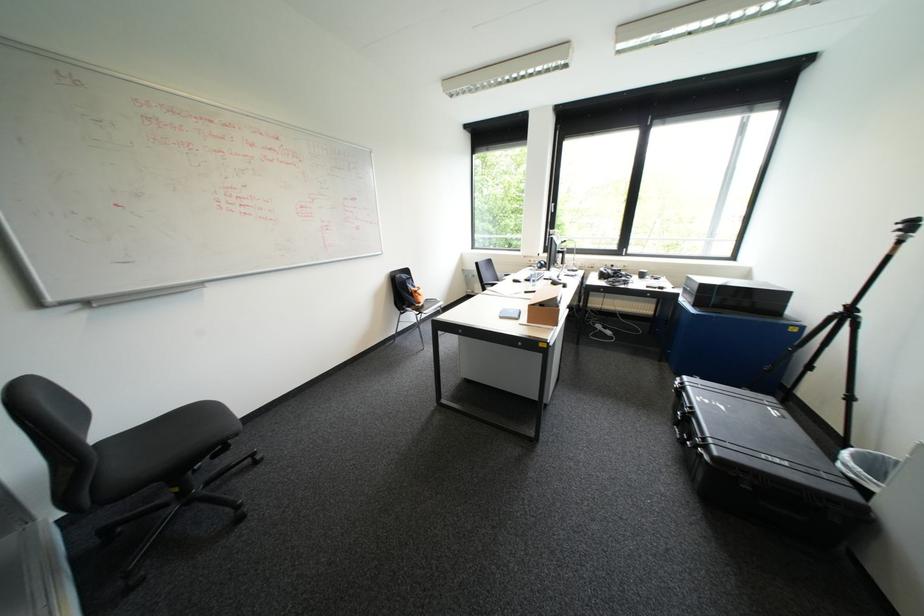
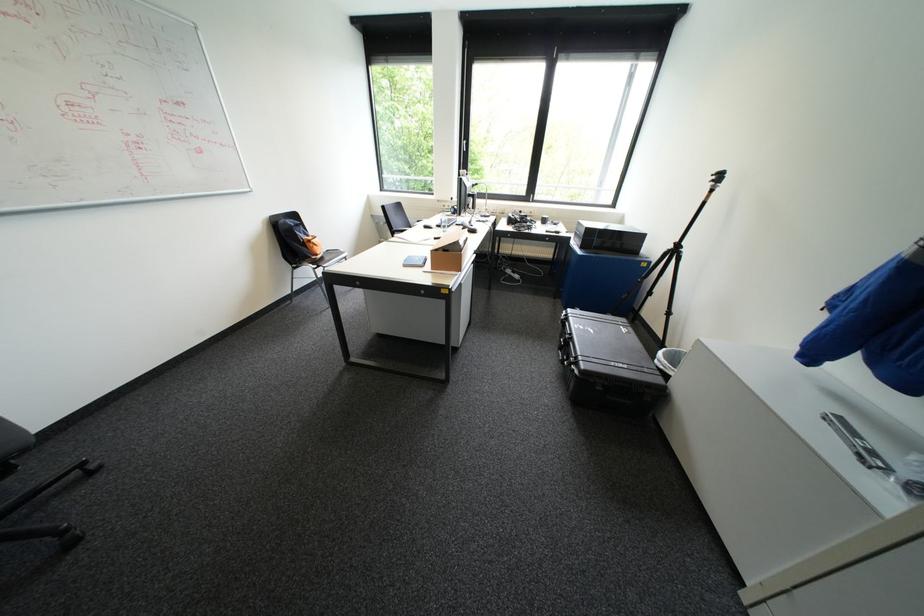
The point at (697,440) is marked in the first image. Where is the corresponding point in the second image?

(574, 361)